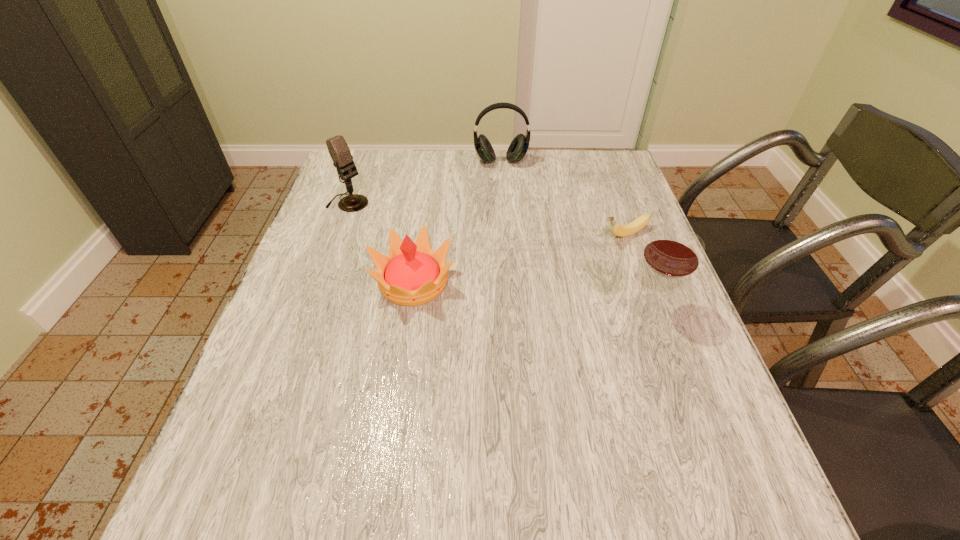
Identify the location of blank area located 0.200m on the back of the wineglass. (625, 234).

Where is `vacant space located on the front-facing side of the second farthest object`? The height and width of the screenshot is (540, 960). vacant space located on the front-facing side of the second farthest object is located at coordinates (442, 255).

I want to click on free space located 0.330m on the front-facing side of the second farthest object, so click(x=447, y=259).

Find the location of a particular element. The image size is (960, 540). free region located on the front-facing side of the second farthest object is located at coordinates (430, 249).

The width and height of the screenshot is (960, 540). What are the coordinates of `vacant space positioned 0.210m on the ear cups of the headset` in the screenshot? It's located at (507, 208).

The image size is (960, 540). Find the location of `vacant region located 0.070m on the ear cups of the headset`. vacant region located 0.070m on the ear cups of the headset is located at coordinates (503, 181).

Locate an element on the screen. Image resolution: width=960 pixels, height=540 pixels. vacant region located on the ear cups of the headset is located at coordinates (507, 211).

The width and height of the screenshot is (960, 540). What are the coordinates of `vacant area situated at the stem of the banana` in the screenshot? It's located at (585, 248).

Locate an element on the screen. The width and height of the screenshot is (960, 540). vacant space located at the stem of the banana is located at coordinates (540, 267).

Image resolution: width=960 pixels, height=540 pixels. I want to click on free space located 0.250m at the stem of the banana, so click(x=523, y=274).